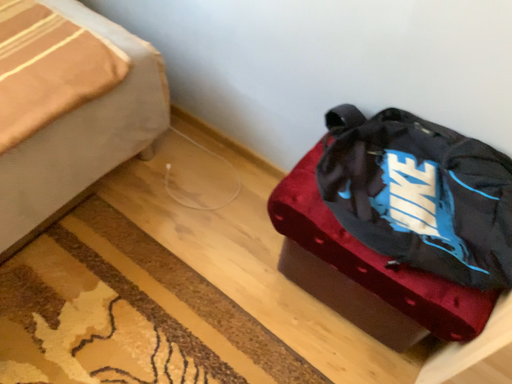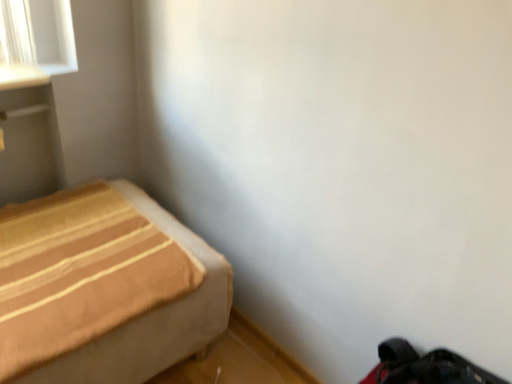
Question: Which way did the camera rotate in the video?

Choices:
 (A) rotated upward
 (B) rotated downward

Answer: (A)